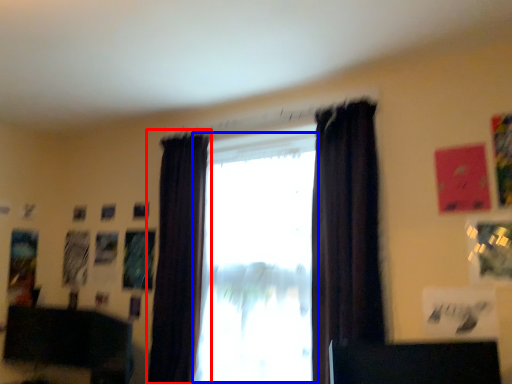
Question: Which point is further to the camera, curtain (highlighted by a red box) or window (highlighted by a blue box)?

Choices:
 (A) curtain
 (B) window

Answer: (A)